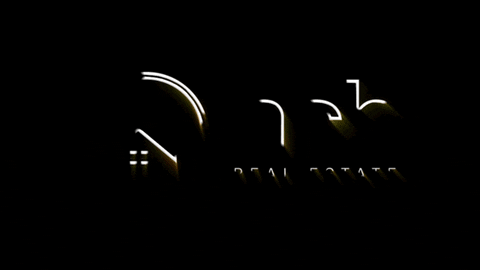
Locate an element on the screen. chimney is located at coordinates (184, 132).